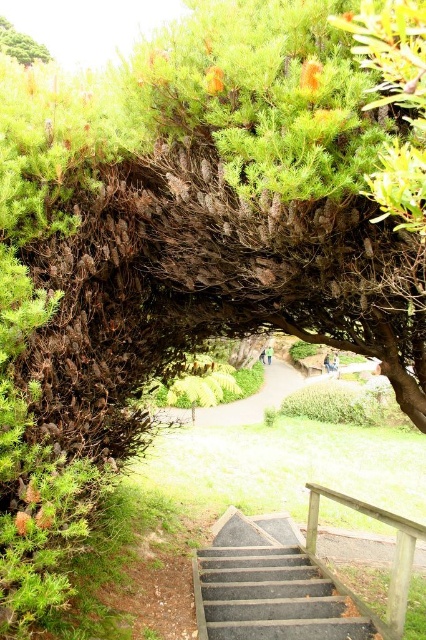
Can you confirm if dark gray concrete stairs at center is positioned to the right of green leafy tree at upper left?

Indeed, dark gray concrete stairs at center is positioned on the right side of green leafy tree at upper left.

Is point (236, 600) positioned in front of point (23, 61)?

Yes, it is.

The image size is (426, 640). I want to click on dark gray concrete stairs at center, so click(267, 586).

Does dark gray concrete stairs at center have a lesser width compared to green grassy path at center?

Indeed, dark gray concrete stairs at center has a lesser width compared to green grassy path at center.

The height and width of the screenshot is (640, 426). Describe the element at coordinates (267, 586) in the screenshot. I see `dark gray concrete stairs at center` at that location.

This screenshot has width=426, height=640. Describe the element at coordinates (267, 586) in the screenshot. I see `dark gray concrete stairs at center` at that location.

The width and height of the screenshot is (426, 640). I want to click on dark gray concrete stairs at center, so [267, 586].

Between dark gray concrete stairs at center and wooden rail at center, which one has less height?

With less height is dark gray concrete stairs at center.

Is dark gray concrete stairs at center to the left of wooden rail at center from the viewer's perspective?

Yes, dark gray concrete stairs at center is to the left of wooden rail at center.

Between point (215, 609) and point (316, 524), which one is positioned in front?

Point (215, 609) is more forward.

The image size is (426, 640). In order to click on dark gray concrete stairs at center in this screenshot , I will do `click(267, 586)`.